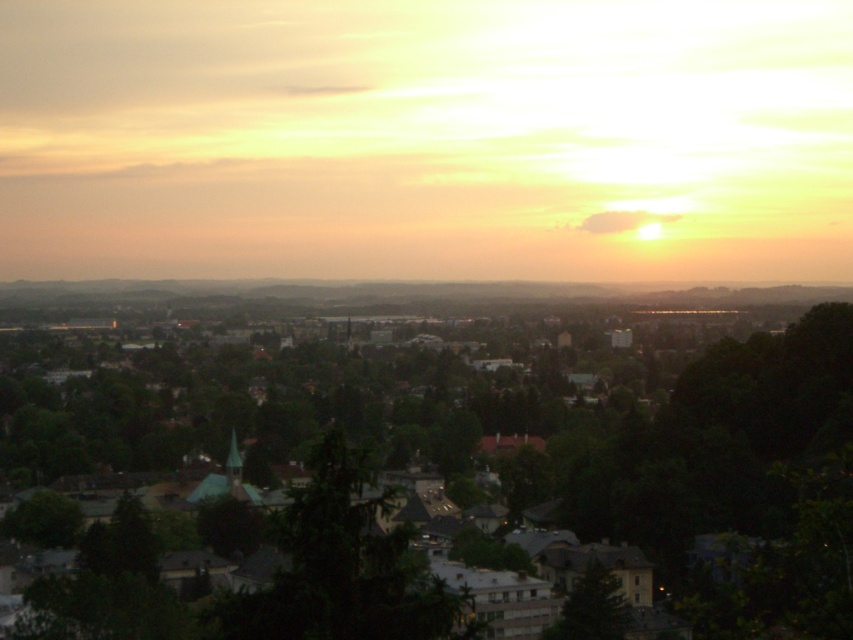
You are standing at the edge of the city park and looking towards the city skyline. You notice the dark gray concrete buildings at center and the green matte tree at lower center. Which of these two objects is positioned to the left of the other?

The dark gray concrete buildings at center are to the left of the green matte tree at lower center.

You are an urban planner assessing the city layout. You need to determine if there is enough space between the dark gray concrete buildings at center and the green matte tree at lower center to install a new pedestrian walkway. Can you confirm if the buildings are wider than the tree?

The dark gray concrete buildings at center are wider than the green matte tree at lower center, so there is sufficient space to install a new pedestrian walkway between them.

You are an architect analyzing the city layout. You observe two points of interest in the cityscape image. The first point is located at coordinates point (144, 536), and the second is at point (590, 589). Based on their positions, which point is closer to the horizon line?

Point (144, 536) is behind point (590, 589), so it is farther from the horizon line. Therefore, point (590, 589) is closer to the horizon line.